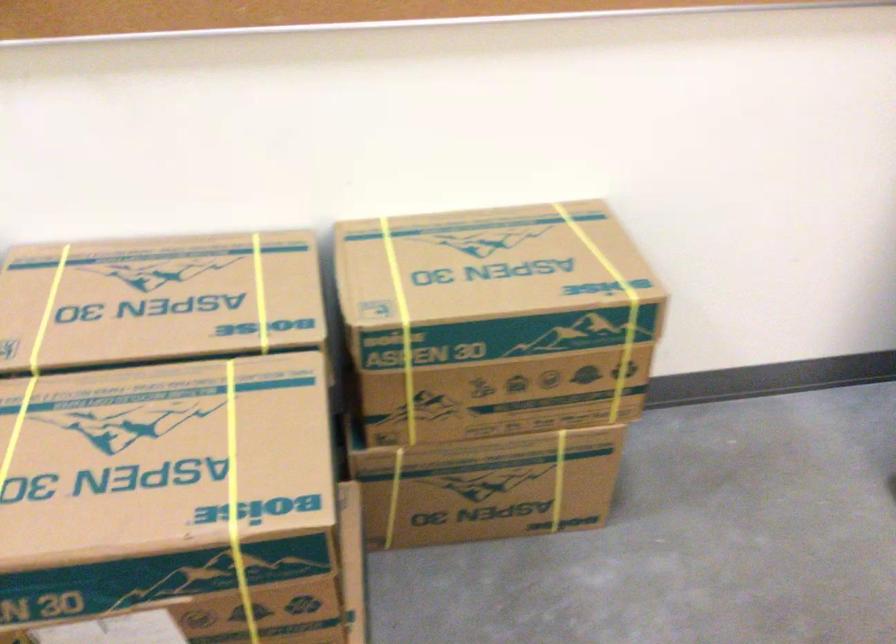
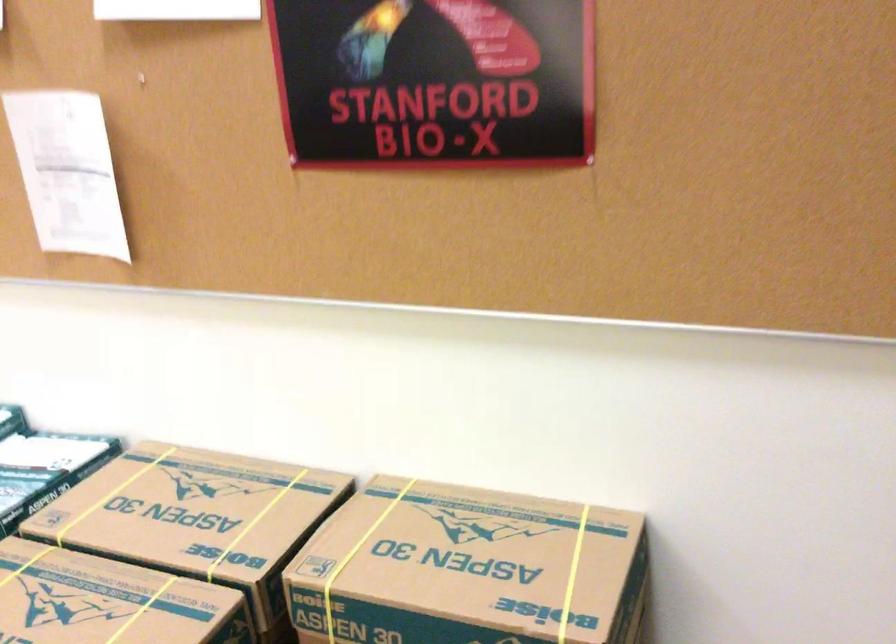
In the second image, find the point that corresponds to (x=515, y=275) in the first image.

(468, 569)